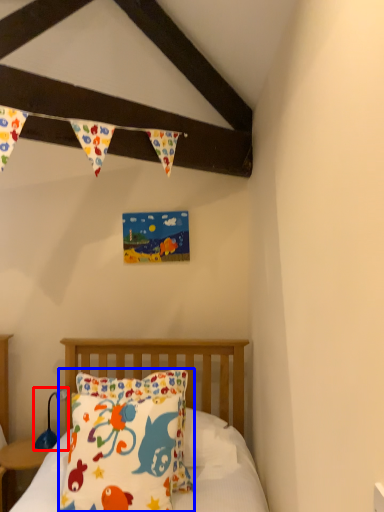
Question: Which object appears farthest to the camera in this image, lamp (highlighted by a red box) or pillow (highlighted by a blue box)?

Choices:
 (A) lamp
 (B) pillow

Answer: (A)